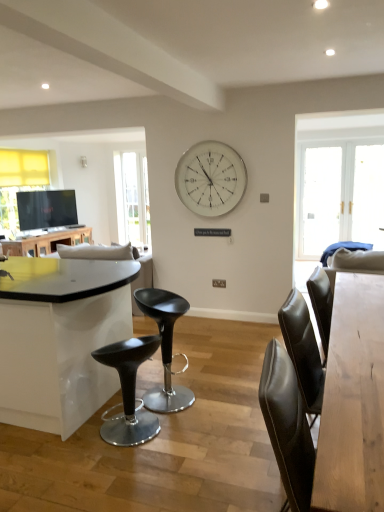
Question: Relative to shiny black stool at center, is light brown wooden table at right, placed as the first table when sorted from front to back, in front or behind?

Choices:
 (A) behind
 (B) front

Answer: (B)

Question: Is point (332, 459) closer or farther from the camera than point (148, 433)?

Choices:
 (A) farther
 (B) closer

Answer: (B)

Question: Based on their relative distances, which object is farther from the light brown wooden table at right, the 2th table positioned from the top?

Choices:
 (A) matte black table at left, which appears as the 2th table when viewed from the front
 (B) white glass clock at upper center
 (C) black plastic stool at center
 (D) clear glass door at upper left
 (E) shiny black stool at center

Answer: (D)

Question: Which object is positioned closest to the black plastic stool at center?

Choices:
 (A) clear glass door at upper left
 (B) white fabric couch at center
 (C) matte black table at left, which is counted as the 1th table, starting from the left
 (D) light brown wooden table at right, acting as the 1th table starting from the bottom
 (E) shiny black stool at center

Answer: (E)